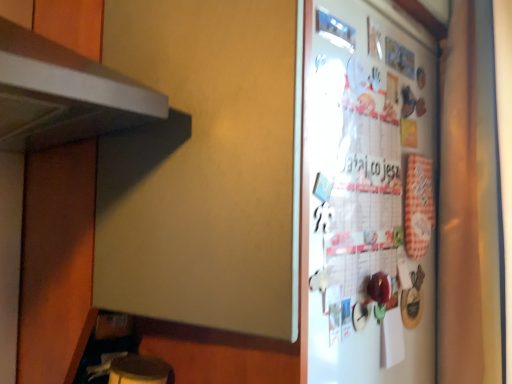
Question: Does white fabric curtain at right have a larger size compared to white glossy refrigerator at right?

Choices:
 (A) yes
 (B) no

Answer: (A)

Question: Is white fabric curtain at right outside of white glossy refrigerator at right?

Choices:
 (A) yes
 (B) no

Answer: (A)

Question: Does white fabric curtain at right turn towards white glossy refrigerator at right?

Choices:
 (A) yes
 (B) no

Answer: (A)

Question: Is white fabric curtain at right at the right side of white glossy refrigerator at right?

Choices:
 (A) yes
 (B) no

Answer: (A)

Question: Is white fabric curtain at right next to white glossy refrigerator at right?

Choices:
 (A) no
 (B) yes

Answer: (A)

Question: From a real-world perspective, is white fabric curtain at right located beneath white glossy refrigerator at right?

Choices:
 (A) yes
 (B) no

Answer: (B)

Question: From the image's perspective, is white glossy refrigerator at right over white fabric curtain at right?

Choices:
 (A) yes
 (B) no

Answer: (B)

Question: Is white glossy refrigerator at right to the left of white fabric curtain at right from the viewer's perspective?

Choices:
 (A) yes
 (B) no

Answer: (A)

Question: Is white glossy refrigerator at right at the right side of white fabric curtain at right?

Choices:
 (A) yes
 (B) no

Answer: (B)

Question: Can you confirm if white glossy refrigerator at right is bigger than white fabric curtain at right?

Choices:
 (A) yes
 (B) no

Answer: (B)

Question: Does white glossy refrigerator at right come behind white fabric curtain at right?

Choices:
 (A) no
 (B) yes

Answer: (A)

Question: Is white glossy refrigerator at right with white fabric curtain at right?

Choices:
 (A) no
 (B) yes

Answer: (A)

Question: Looking at the image, does white glossy refrigerator at right seem bigger or smaller compared to white fabric curtain at right?

Choices:
 (A) small
 (B) big

Answer: (A)